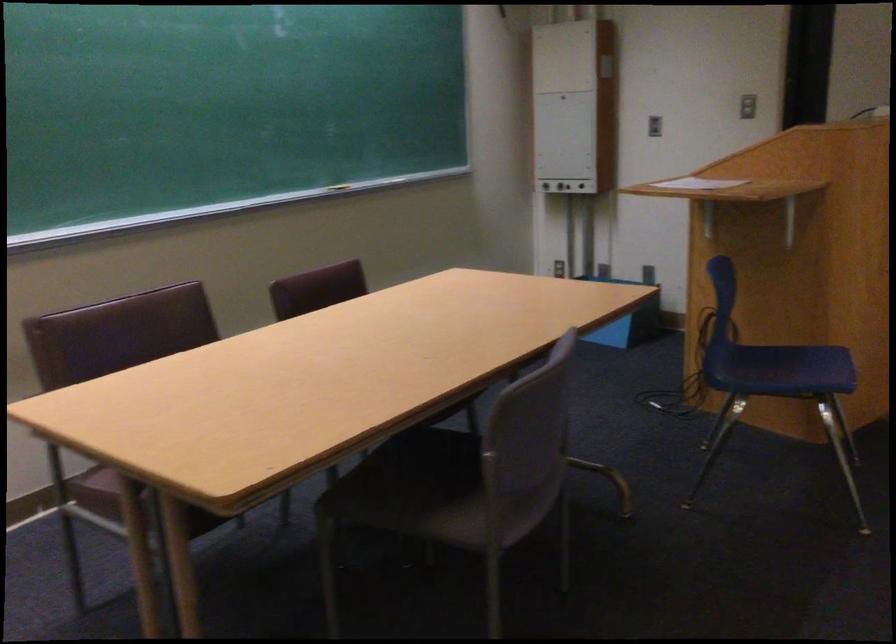
Find the location of a particular element. The image size is (896, 644). blue chair sitting surface is located at coordinates (782, 368).